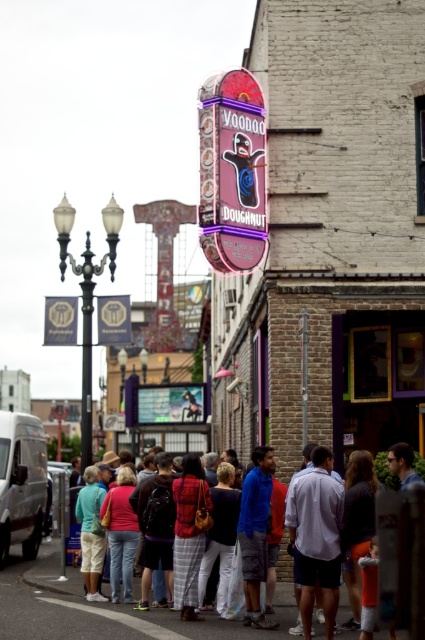
Question: Which of these objects is positioned closest to the white asphalt at lower center?

Choices:
 (A) plaid fabric shirt at center
 (B) gold metallic sign at left
 (C) neon sign at center
 (D) gold metallic sign at center

Answer: (A)

Question: Is plaid fabric shirt at center bigger than gold metallic sign at left?

Choices:
 (A) yes
 (B) no

Answer: (A)

Question: Which object is farther from the camera taking this photo?

Choices:
 (A) gold metallic sign at center
 (B) white asphalt at lower center

Answer: (A)

Question: Which point is farther to the camera?

Choices:
 (A) plaid fabric shirt at center
 (B) gold metallic sign at left
 (C) white asphalt at lower center

Answer: (B)

Question: Does neon sign at center come behind white asphalt at lower center?

Choices:
 (A) yes
 (B) no

Answer: (A)

Question: Can you confirm if neon sign at center is positioned to the right of plaid fabric shirt at center?

Choices:
 (A) no
 (B) yes

Answer: (A)